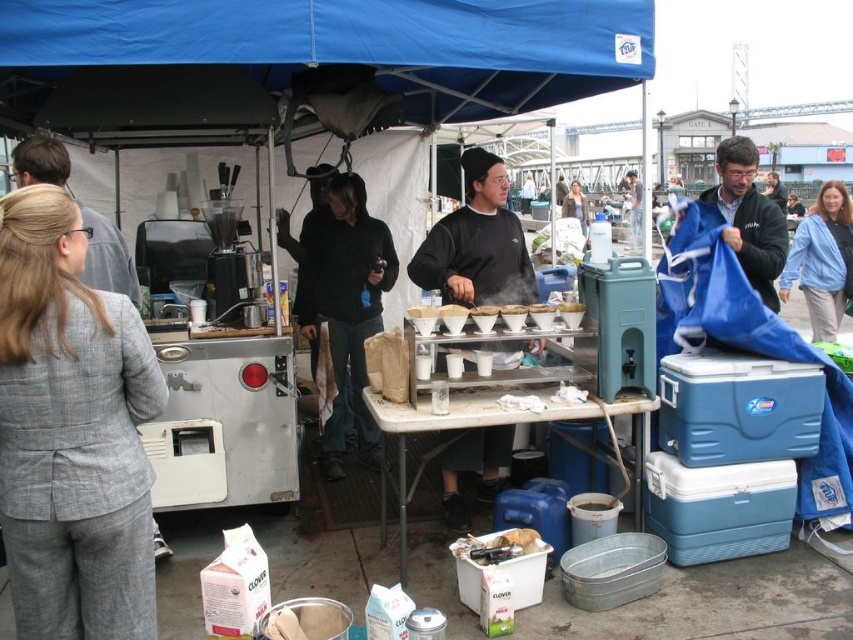
Question: Which of these objects is positioned closest to the gray suit jacket at left?

Choices:
 (A) gray wool suit at left
 (B) white paper cone at center
 (C) dark blue fabric at right
 (D) black cotton hoodie at center

Answer: (A)

Question: Which object is the farthest from the blue cotton jacket at upper right?

Choices:
 (A) black cotton hoodie at center
 (B) white paper cone at center
 (C) white paper cup at center

Answer: (A)

Question: In this image, where is gray wool suit at left located relative to blue cotton jacket at upper right?

Choices:
 (A) above
 (B) below

Answer: (B)

Question: In this image, where is gray suit jacket at left located relative to white paper cup at center?

Choices:
 (A) below
 (B) above

Answer: (B)

Question: Estimate the real-world distances between objects in this image. Which object is farther from the gray suit jacket at left?

Choices:
 (A) black matte sweatshirt at center
 (B) gray wool suit at left
 (C) blue fabric canopy at upper center

Answer: (A)

Question: Can you confirm if gray wool suit at left is positioned below black matte sweatshirt at center?

Choices:
 (A) no
 (B) yes

Answer: (B)